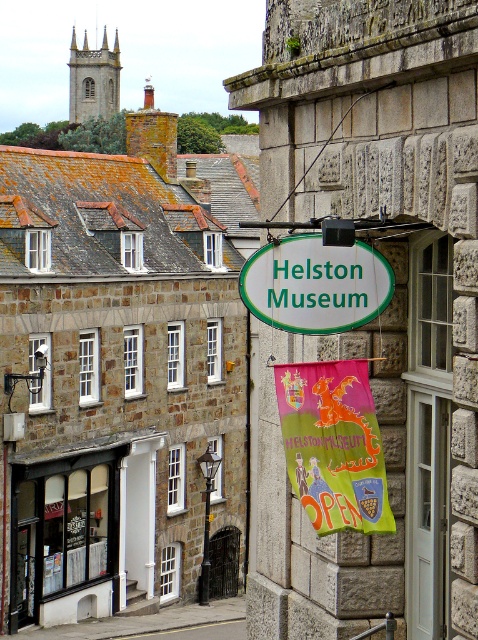
Who is taller, white glass storefront at lower left or white oval sign at center?

white glass storefront at lower left is taller.

Can you confirm if white glass storefront at lower left is bigger than white oval sign at center?

Correct, white glass storefront at lower left is larger in size than white oval sign at center.

Is point (102, 506) farther from camera compared to point (378, 280)?

Yes, it is behind point (378, 280).

Find the location of a particular element. The height and width of the screenshot is (640, 478). white glass storefront at lower left is located at coordinates (83, 531).